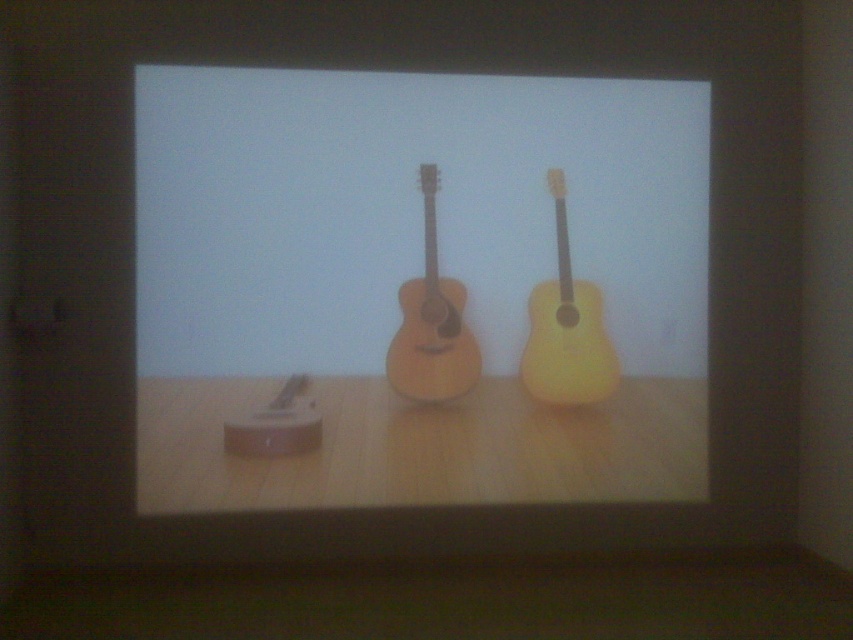
You are setting up a music exhibition and need to arrange two guitars on a display table. The yellow matte guitar at right and the natural wood acoustic guitar at center must be placed exactly 30 centimeters apart. Based on their current positions in the image, do you need to move them closer together or farther apart to meet the requirement?

The current distance between the yellow matte guitar at right and the natural wood acoustic guitar at center is 28.84 centimeters. To reach the required 30 centimeters, you need to move them slightly farther apart.